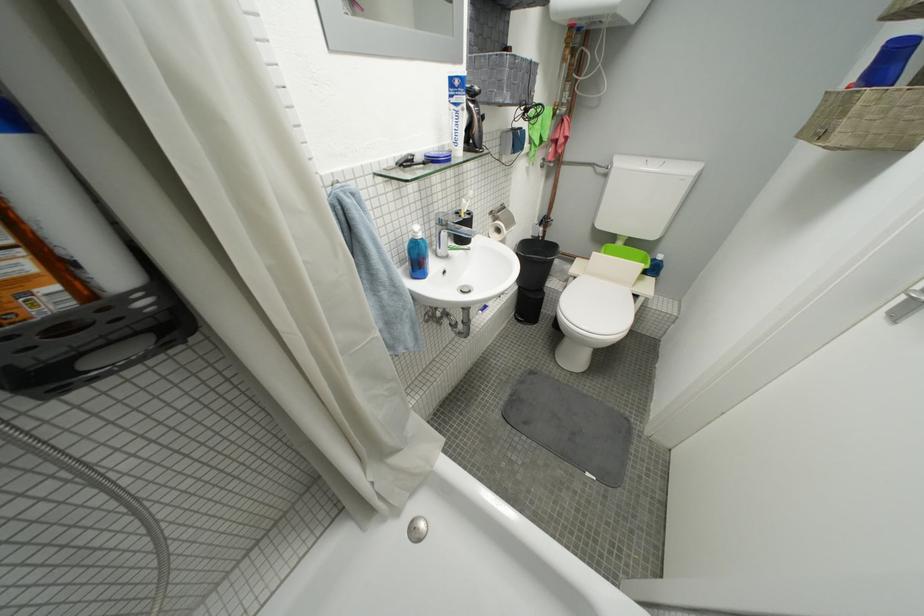
Describe the element at coordinates (652, 164) in the screenshot. I see `the toilet flush button` at that location.